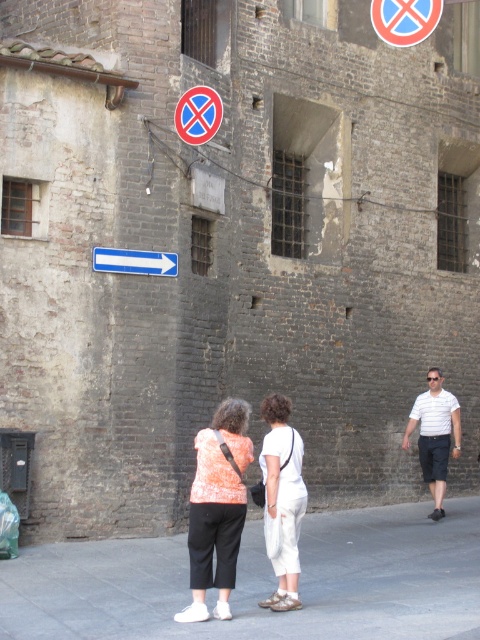
Question: Which point is farther to the camera?

Choices:
 (A) gray concrete pavement at center
 (B) blue plastic arrow at center

Answer: (B)

Question: Among these objects, which one is farthest from the camera?

Choices:
 (A) white cotton pants at center
 (B) orange printed blouse at center
 (C) red plastic sign at upper center
 (D) white cotton shirt at right

Answer: (D)

Question: Is gray concrete pavement at center behind blue plastic arrow at center?

Choices:
 (A) yes
 (B) no

Answer: (B)

Question: Is gray concrete pavement at center smaller than white cotton pants at center?

Choices:
 (A) no
 (B) yes

Answer: (A)

Question: Among these points, which one is farthest from the camera?

Choices:
 (A) (283, 525)
 (B) (232, 528)
 (C) (441, 474)

Answer: (C)

Question: Observing the image, what is the correct spatial positioning of orange printed blouse at center in reference to blue plastic arrow at center?

Choices:
 (A) right
 (B) left

Answer: (A)